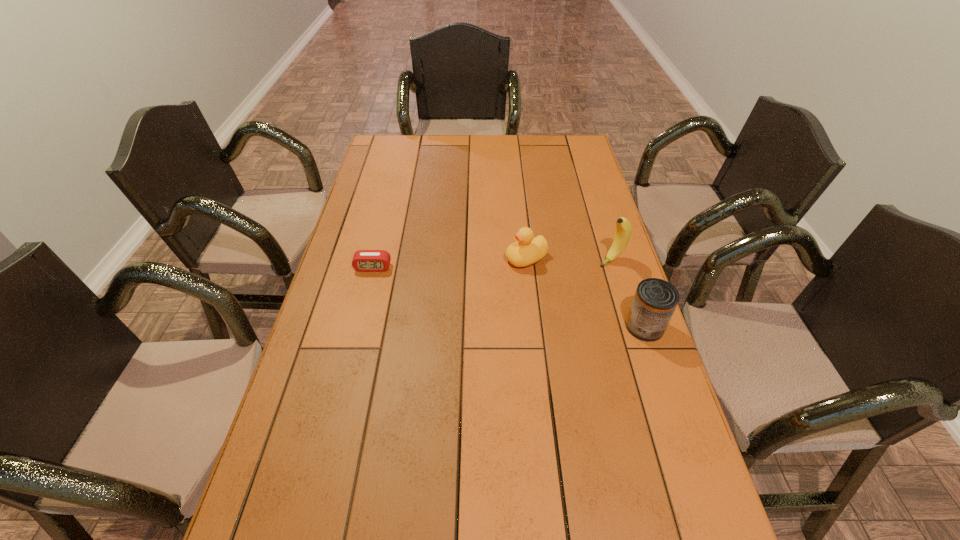
Where is `vacant space located 0.390m on the face of the second object from left to right`? Image resolution: width=960 pixels, height=540 pixels. vacant space located 0.390m on the face of the second object from left to right is located at coordinates (393, 317).

At what (x,y) coordinates should I click in order to perform the action: click on free space located 0.230m on the face of the second object from left to right. Please return your answer as a coordinate pair (x, y). The width and height of the screenshot is (960, 540). Looking at the image, I should click on (444, 294).

Find the location of a particular element. Image resolution: width=960 pixels, height=540 pixels. free space located 0.400m on the face of the second object from left to right is located at coordinates (390, 319).

You are a GUI agent. You are given a task and a screenshot of the screen. Output one action in this format:
    pyautogui.click(x=<x>, y=<y>)
    Task: Click on the object that is at the left edge
    The height and width of the screenshot is (540, 960).
    Given the screenshot: What is the action you would take?
    pyautogui.click(x=363, y=260)

This screenshot has height=540, width=960. I want to click on can that is at the right edge, so click(x=655, y=300).

Where is `banana located in the right edge section of the desktop`? banana located in the right edge section of the desktop is located at coordinates (623, 231).

I want to click on vacant space at the far edge, so click(452, 141).

I want to click on free space at the left edge of the desktop, so point(331,375).

You are a GUI agent. You are given a task and a screenshot of the screen. Output one action in this format:
    pyautogui.click(x=<x>, y=<y>)
    Task: Click on the vacant area at the right edge
    
    Given the screenshot: What is the action you would take?
    pyautogui.click(x=597, y=230)

Identify the location of vacant space at the far left corner. (385, 159).